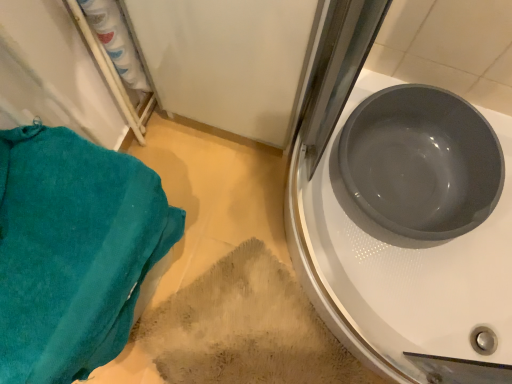
Question: Considering the relative positions of matte gray basin at right and beige textured rug at lower center in the image provided, is matte gray basin at right in front of beige textured rug at lower center?

Choices:
 (A) no
 (B) yes

Answer: (B)

Question: Does matte gray basin at right have a lesser height compared to beige textured rug at lower center?

Choices:
 (A) no
 (B) yes

Answer: (A)

Question: Is matte gray basin at right thinner than beige textured rug at lower center?

Choices:
 (A) no
 (B) yes

Answer: (B)

Question: From a real-world perspective, is matte gray basin at right physically above beige textured rug at lower center?

Choices:
 (A) no
 (B) yes

Answer: (B)

Question: Does matte gray basin at right have a greater height compared to beige textured rug at lower center?

Choices:
 (A) no
 (B) yes

Answer: (B)

Question: From the image's perspective, is matte gray basin at right above beige textured rug at lower center?

Choices:
 (A) no
 (B) yes

Answer: (B)

Question: Is beige textured rug at lower center at the left side of matte gray basin at right?

Choices:
 (A) yes
 (B) no

Answer: (A)

Question: Would you say beige textured rug at lower center is outside matte gray basin at right?

Choices:
 (A) yes
 (B) no

Answer: (A)

Question: Considering the relative sizes of beige textured rug at lower center and matte gray basin at right in the image provided, is beige textured rug at lower center shorter than matte gray basin at right?

Choices:
 (A) yes
 (B) no

Answer: (A)

Question: Does beige textured rug at lower center come in front of matte gray basin at right?

Choices:
 (A) no
 (B) yes

Answer: (A)

Question: Is matte gray basin at right at the back of beige textured rug at lower center?

Choices:
 (A) yes
 (B) no

Answer: (B)

Question: Would you say beige textured rug at lower center is a long distance from matte gray basin at right?

Choices:
 (A) yes
 (B) no

Answer: (B)

Question: Considering the relative positions of beige textured rug at lower center and matte gray basin at upper right in the image provided, is beige textured rug at lower center in front of matte gray basin at upper right?

Choices:
 (A) yes
 (B) no

Answer: (B)